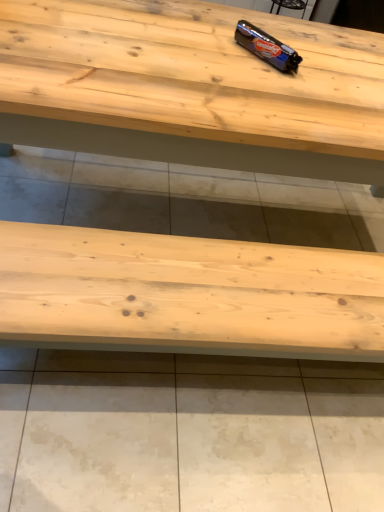
Question: Considering their positions, is shiny metallic chocolate bar at upper center located in front of or behind natural wood table at center?

Choices:
 (A) behind
 (B) front

Answer: (A)

Question: From the image's perspective, is shiny metallic chocolate bar at upper center above or below natural wood table at center?

Choices:
 (A) above
 (B) below

Answer: (A)

Question: Considering the positions of shiny metallic chocolate bar at upper center and natural wood table at center in the image, is shiny metallic chocolate bar at upper center taller or shorter than natural wood table at center?

Choices:
 (A) tall
 (B) short

Answer: (B)

Question: Is point (64, 145) positioned closer to the camera than point (240, 25)?

Choices:
 (A) farther
 (B) closer

Answer: (B)

Question: Would you say natural wood table at center is inside or outside shiny metallic chocolate bar at upper center?

Choices:
 (A) inside
 (B) outside

Answer: (B)

Question: From the image's perspective, is natural wood table at center positioned above or below shiny metallic chocolate bar at upper center?

Choices:
 (A) below
 (B) above

Answer: (A)

Question: In the image, is natural wood table at center positioned in front of or behind shiny metallic chocolate bar at upper center?

Choices:
 (A) behind
 (B) front

Answer: (B)